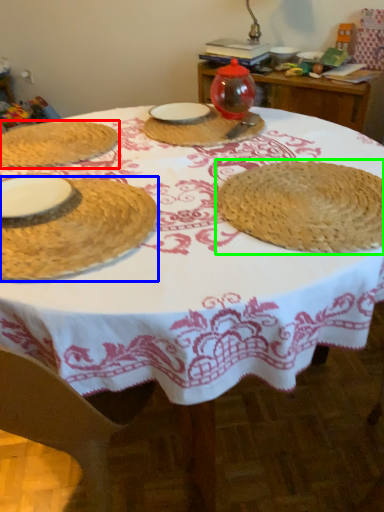
Question: Which is farther away from table (highlighted by a red box)? tableware (highlighted by a blue box) or straw hat (highlighted by a green box)?

Choices:
 (A) tableware
 (B) straw hat

Answer: (B)